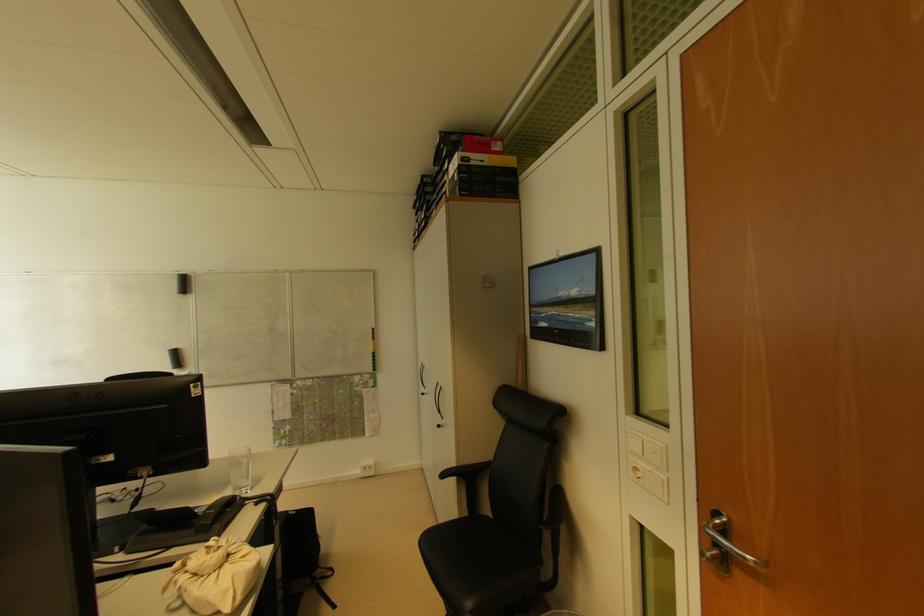
Where is `silver door handle`? Image resolution: width=924 pixels, height=616 pixels. silver door handle is located at coordinates (723, 545).